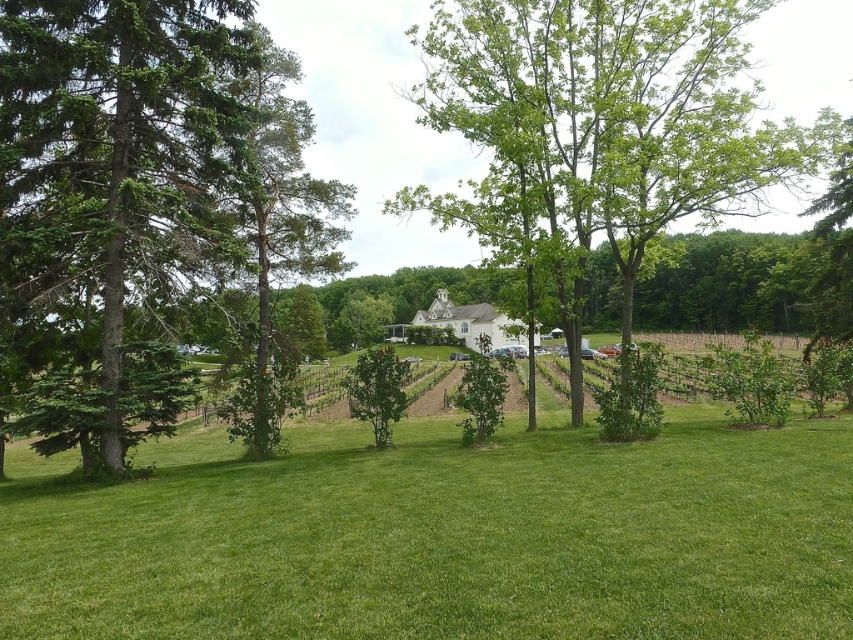
Is point (576, 204) behind point (258, 262)?

No.

Is point (561, 257) positioned behind point (277, 394)?

Yes, it is.

Identify the location of green leafy tree at center. This screenshot has width=853, height=640. (598, 132).

Which is behind, point (566, 209) or point (157, 227)?

Point (566, 209)

Between point (502, 22) and point (93, 196), which one is positioned in front?

Point (93, 196) is more forward.

The height and width of the screenshot is (640, 853). I want to click on green leafy tree at center, so click(598, 132).

Does green coniferous tree at left lie in front of green textured tree at left?

Yes, green coniferous tree at left is closer to the viewer.

Is point (140, 76) positioned after point (248, 252)?

No, it is in front of (248, 252).

I want to click on green coniferous tree at left, so click(x=115, y=141).